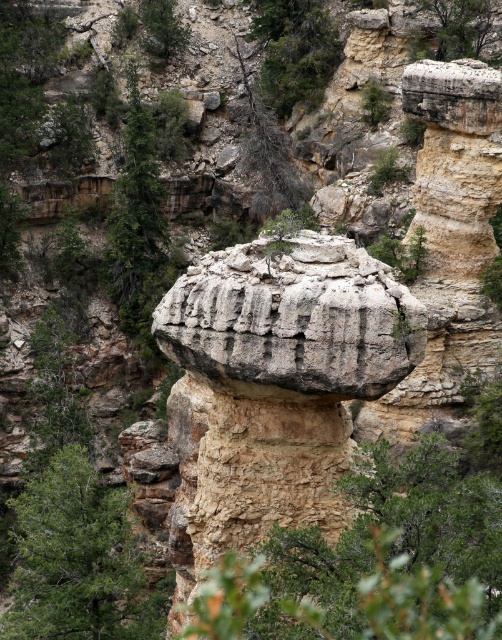
You are standing at point (78, 561) in the canyon. What do you see around you?

You see a green leafy tree at lower left at point (78, 561).

You are standing at the base of the hoodoo and want to take a photo of the green leafy tree at lower left and the green rough tree at upper left. Which tree will appear larger in the photo?

The green leafy tree at lower left will appear larger in the photo because it is closer to the camera than the green rough tree at upper left.